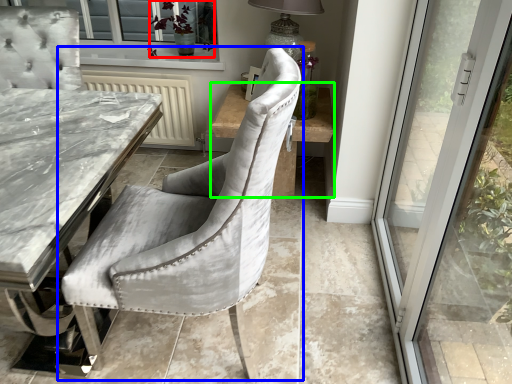
Question: Which object is the farthest from plant (highlighted by a red box)? Choose among these: chair (highlighted by a blue box) or side table (highlighted by a green box).

Choices:
 (A) chair
 (B) side table

Answer: (A)